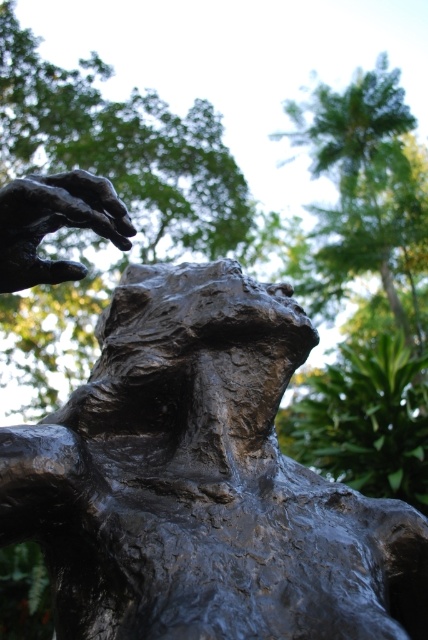
Does bronze sculpture at center have a lesser height compared to bronze textured hand at upper left?

No, bronze sculpture at center is not shorter than bronze textured hand at upper left.

Who is more forward, (247,609) or (47,227)?

Point (247,609) is in front.

Find the location of `bronze sculpture at center`. bronze sculpture at center is located at coordinates (202, 483).